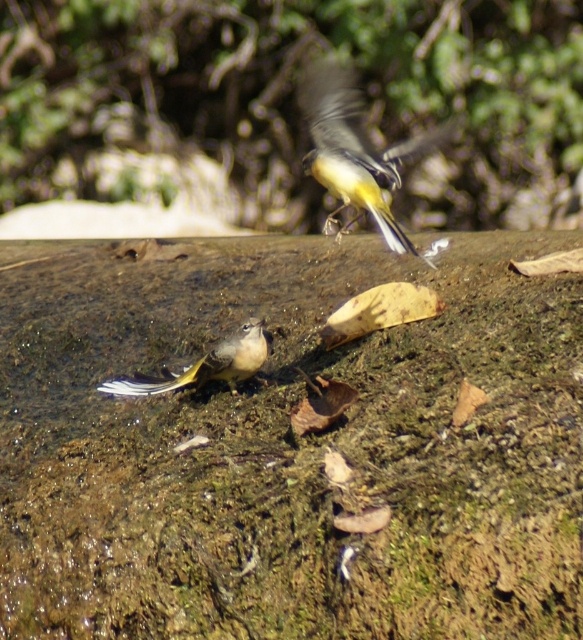
Question: Which of these objects is positioned farthest from the yellow-green feathers bird at center?

Choices:
 (A) yellow-green feathers at center
 (B) green leafy tree at upper center

Answer: (B)

Question: Is yellow-green feathers bird at center closer to camera compared to yellow-green feathers at center?

Choices:
 (A) yes
 (B) no

Answer: (A)

Question: Does green leafy tree at upper center have a larger size compared to yellow-green feathers bird at center?

Choices:
 (A) yes
 (B) no

Answer: (A)

Question: Which of the following is the closest to the observer?

Choices:
 (A) (110, 390)
 (B) (343, 112)
 (C) (482, 161)

Answer: (B)

Question: Which object is the closest to the green leafy tree at upper center?

Choices:
 (A) yellow-green feathers bird at center
 (B) yellow-green feathers at center

Answer: (A)

Question: Is green leafy tree at upper center thinner than yellow-green feathers bird at center?

Choices:
 (A) yes
 (B) no

Answer: (B)